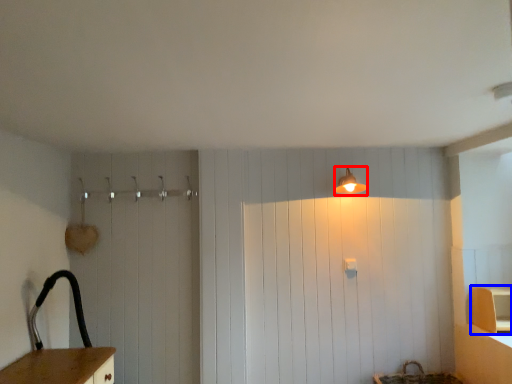
Question: Which of the following is the farthest to the observer, light fixture (highlighted by a red box) or cabinetry (highlighted by a blue box)?

Choices:
 (A) light fixture
 (B) cabinetry

Answer: (A)